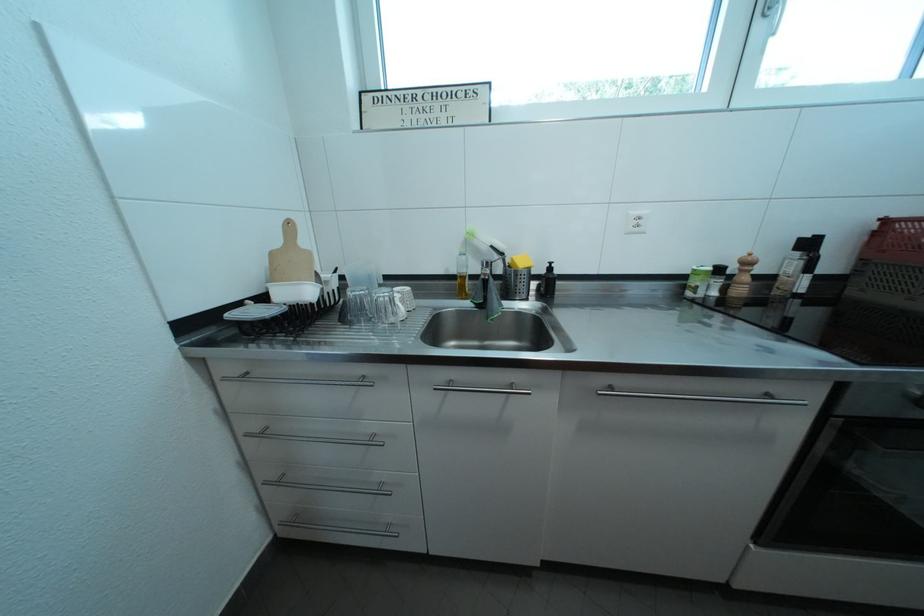
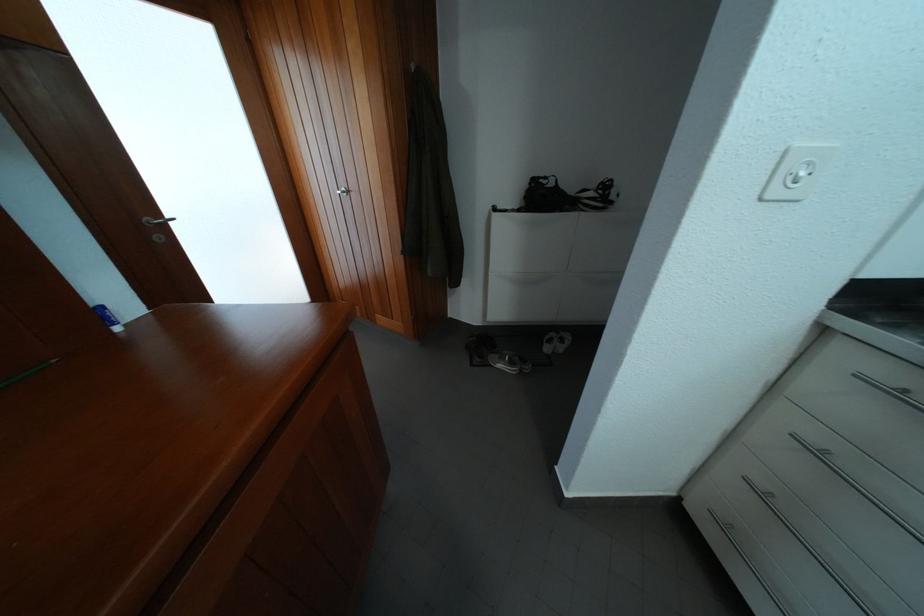
Where in the second image is the point corresponding to the point at 272,440 from the first image?

(829, 460)